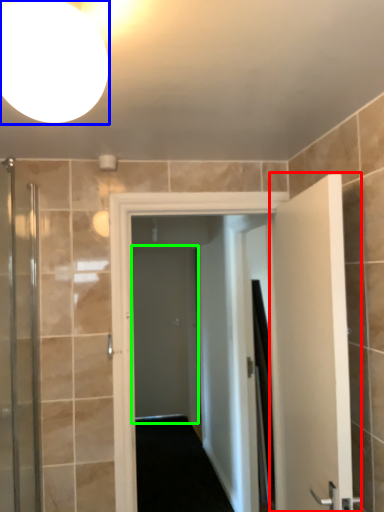
Question: Estimate the real-world distances between objects in this image. Which object is farther from door (highlighted by a red box), light fixture (highlighted by a blue box) or screen door (highlighted by a green box)?

Choices:
 (A) light fixture
 (B) screen door

Answer: (B)